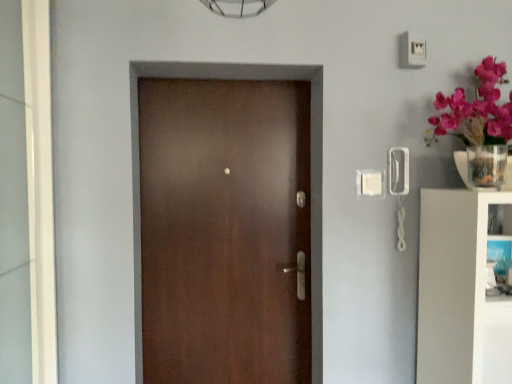
The width and height of the screenshot is (512, 384). Describe the element at coordinates (460, 291) in the screenshot. I see `white glossy bookshelf at right` at that location.

This screenshot has width=512, height=384. I want to click on white glossy bookshelf at right, so click(x=460, y=291).

What do you see at coordinates (26, 196) in the screenshot? I see `white glossy glass door at left` at bounding box center [26, 196].

Image resolution: width=512 pixels, height=384 pixels. In order to click on clear glass vase at upper right in this screenshot , I will do `click(486, 166)`.

Is point (443, 310) positioned after point (476, 146)?

No.

Identify the location of glass vase that is behind the white glossy bookshelf at right. This screenshot has width=512, height=384. (486, 166).

From the picture: From the image's perspective, does white glossy bookshelf at right appear lower than clear glass vase at upper right?

Yes, from the image's perspective, white glossy bookshelf at right is below clear glass vase at upper right.

From their relative heights in the image, would you say white glossy bookshelf at right is taller or shorter than clear glass vase at upper right?

white glossy bookshelf at right is taller than clear glass vase at upper right.

Can you confirm if white glossy bookshelf at right is thinner than satin brown door at center?

In fact, white glossy bookshelf at right might be wider than satin brown door at center.

Is the depth of white glossy bookshelf at right less than that of satin brown door at center?

Yes, white glossy bookshelf at right is closer to the viewer.

Based on the photo, is white glossy bookshelf at right taller or shorter than satin brown door at center?

Considering their sizes, white glossy bookshelf at right has less height than satin brown door at center.

Between clear glass vase at upper right and white glossy glass door at left, which one has more height?

Standing taller between the two is white glossy glass door at left.

I want to click on glass vase on the right of white glossy glass door at left, so click(x=486, y=166).

Is clear glass vase at upper right in contact with white glossy glass door at left?

There is a gap between clear glass vase at upper right and white glossy glass door at left.

From the picture: Does clear glass vase at upper right have a smaller size compared to white glossy glass door at left?

Yes.

Which is more to the left, clear glass vase at upper right or satin brown door at center?

satin brown door at center.

Locate an element on the screen. This screenshot has height=384, width=512. door behind the clear glass vase at upper right is located at coordinates (224, 231).

Which object is thinner, clear glass vase at upper right or satin brown door at center?

satin brown door at center.

What's the angular difference between clear glass vase at upper right and satin brown door at center's facing directions?

The angular difference between clear glass vase at upper right and satin brown door at center is 1.76 degrees.

Is white glossy glass door at left in front of or behind clear glass vase at upper right in the image?

In the image, white glossy glass door at left appears in front of clear glass vase at upper right.

Is white glossy glass door at left with clear glass vase at upper right?

No, white glossy glass door at left is not touching clear glass vase at upper right.

From a real-world perspective, is white glossy glass door at left on clear glass vase at upper right?

No.

Identify the location of glass door located below the clear glass vase at upper right (from the image's perspective). (26, 196).

What's the angular difference between white glossy glass door at left and white glossy bookshelf at right's facing directions?

white glossy glass door at left and white glossy bookshelf at right are facing 88.8 degrees away from each other.

Is white glossy bookshelf at right a part of white glossy glass door at left?

No, white glossy bookshelf at right is not a part of white glossy glass door at left.

Which object is wider, white glossy glass door at left or white glossy bookshelf at right?

white glossy bookshelf at right is wider.

Is white glossy glass door at left beside white glossy bookshelf at right?

white glossy glass door at left and white glossy bookshelf at right are clearly separated.

Relative to white glossy bookshelf at right, is clear glass vase at upper right in front or behind?

Clearly, clear glass vase at upper right is behind white glossy bookshelf at right.

Is clear glass vase at upper right touching white glossy bookshelf at right?

No, clear glass vase at upper right is not making contact with white glossy bookshelf at right.

From the picture: Which point is more distant from viewer, [502,150] or [450,196]?

The point [450,196] is farther from the camera.

Considering the sizes of objects clear glass vase at upper right and white glossy bookshelf at right in the image provided, who is smaller, clear glass vase at upper right or white glossy bookshelf at right?

clear glass vase at upper right is smaller.

I want to click on glass vase to the left of white glossy bookshelf at right, so click(486, 166).

I want to click on bookshelf lying below the satin brown door at center (from the image's perspective), so click(x=460, y=291).

Which object lies nearer to the anchor point white glossy bookshelf at right, clear glass vase at upper right or white glossy glass door at left?

clear glass vase at upper right is positioned closer to the anchor white glossy bookshelf at right.

From the image, which object appears to be nearer to white glossy glass door at left, satin brown door at center or white glossy bookshelf at right?

satin brown door at center.

Estimate the real-world distances between objects in this image. Which object is closer to white glossy bookshelf at right, white glossy glass door at left or satin brown door at center?

satin brown door at center lies closer to white glossy bookshelf at right than the other object.

From the image, which object appears to be nearer to satin brown door at center, white glossy glass door at left or white glossy bookshelf at right?

white glossy glass door at left lies closer to satin brown door at center than the other object.

Considering their positions, is white glossy bookshelf at right positioned closer to satin brown door at center than white glossy glass door at left?

white glossy glass door at left lies closer to satin brown door at center than the other object.

Based on their spatial positions, is white glossy bookshelf at right or satin brown door at center closer to clear glass vase at upper right?

white glossy bookshelf at right lies closer to clear glass vase at upper right than the other object.

Looking at the image, which one is located further to satin brown door at center, clear glass vase at upper right or white glossy bookshelf at right?

clear glass vase at upper right.

Considering their positions, is clear glass vase at upper right positioned further to white glossy bookshelf at right than satin brown door at center?

Based on the image, satin brown door at center appears to be further to white glossy bookshelf at right.

Find the location of a particular element. Image resolution: width=512 pixels, height=384 pixels. door between white glossy glass door at left and clear glass vase at upper right in the horizontal direction is located at coordinates (224, 231).

Identify the location of door between white glossy glass door at left and white glossy bookshelf at right from left to right. (224, 231).

In order to click on glass vase between white glossy glass door at left and white glossy bookshelf at right from left to right in this screenshot , I will do `click(486, 166)`.

Where is `glass vase between satin brown door at center and white glossy bookshelf at right`? This screenshot has height=384, width=512. glass vase between satin brown door at center and white glossy bookshelf at right is located at coordinates (486, 166).